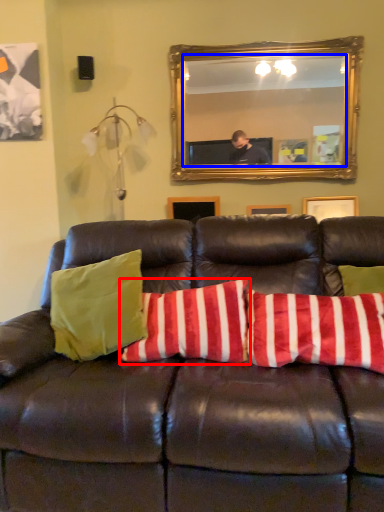
Question: Which point is closer to the camera, pillow (highlighted by a red box) or mirror (highlighted by a blue box)?

Choices:
 (A) pillow
 (B) mirror

Answer: (A)